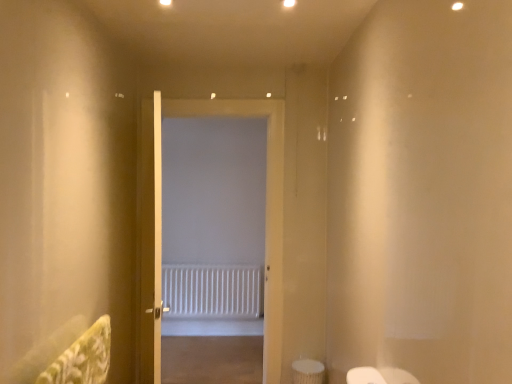
Question: From the image's perspective, is white textured radiator at center located above white wooden door at center, the first door from the front?

Choices:
 (A) no
 (B) yes

Answer: (A)

Question: Is white textured radiator at center behind white wooden door at center, the first door from the front?

Choices:
 (A) no
 (B) yes

Answer: (B)

Question: Is white textured radiator at center not close to white wooden door at center, placed as the 2th door when sorted from back to front?

Choices:
 (A) no
 (B) yes

Answer: (B)

Question: Is white textured radiator at center to the left of white wooden door at center, the first door from the front, from the viewer's perspective?

Choices:
 (A) yes
 (B) no

Answer: (B)

Question: Considering the relative positions of white textured radiator at center and white wooden door at center, the first door from the front, in the image provided, is white textured radiator at center in front of white wooden door at center, the first door from the front,?

Choices:
 (A) yes
 (B) no

Answer: (B)

Question: Looking at the image, does white textured radiator at center seem bigger or smaller compared to white wooden door at center, placed as the 2th door when sorted from back to front?

Choices:
 (A) small
 (B) big

Answer: (A)

Question: In the image, is white textured radiator at center on the left side or the right side of white wooden door at center, the first door from the front?

Choices:
 (A) right
 (B) left

Answer: (A)

Question: From the image's perspective, relative to white wooden door at center, placed as the 2th door when sorted from back to front, is white textured radiator at center above or below?

Choices:
 (A) below
 (B) above

Answer: (A)

Question: Does point (183, 286) appear closer or farther from the camera than point (269, 112)?

Choices:
 (A) farther
 (B) closer

Answer: (A)

Question: From their relative heights in the image, would you say white matte door at center, the 1th door in the back-to-front sequence, is taller or shorter than white textured radiator at center?

Choices:
 (A) short
 (B) tall

Answer: (B)

Question: In the image, is white matte door at center, which ranks as the second door in front-to-back order, positioned in front of or behind white textured radiator at center?

Choices:
 (A) front
 (B) behind

Answer: (A)

Question: Considering the positions of point pyautogui.click(x=275, y=195) and point pyautogui.click(x=223, y=307), is point pyautogui.click(x=275, y=195) closer or farther from the camera than point pyautogui.click(x=223, y=307)?

Choices:
 (A) closer
 (B) farther

Answer: (A)

Question: Is white matte door at center, the 1th door in the back-to-front sequence, wider or thinner than white textured radiator at center?

Choices:
 (A) wide
 (B) thin

Answer: (A)

Question: Considering the positions of white matte door at center, the 1th door in the back-to-front sequence, and white wooden door at center, placed as the 2th door when sorted from back to front, in the image, is white matte door at center, the 1th door in the back-to-front sequence, taller or shorter than white wooden door at center, placed as the 2th door when sorted from back to front,?

Choices:
 (A) tall
 (B) short

Answer: (A)

Question: Looking at their shapes, would you say white matte door at center, the 1th door in the back-to-front sequence, is wider or thinner than white wooden door at center, the first door from the front?

Choices:
 (A) thin
 (B) wide

Answer: (B)